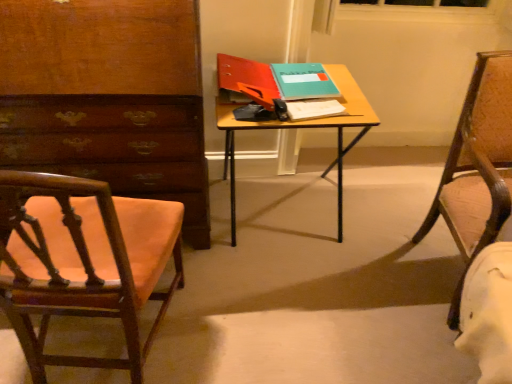
Find the location of a particular element. Image resolution: width=512 pixels, height=384 pixels. free point to the right of white paper notepad at center is located at coordinates (356, 116).